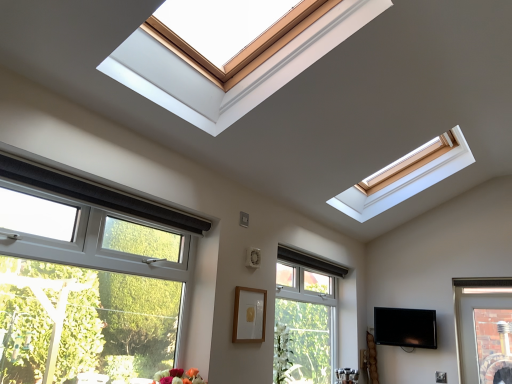
Question: Is black glossy tv at lower right to the left or to the right of clear glass window at center, the 2th window from the left, in the image?

Choices:
 (A) right
 (B) left

Answer: (A)

Question: From the image's perspective, is black glossy tv at lower right located above or below clear glass window at center, the 2th window from the left?

Choices:
 (A) below
 (B) above

Answer: (A)

Question: Which object is positioned closest to the white glossy vase at center?

Choices:
 (A) wooden picture frame at center
 (B) white plastic window at lower left, which is the 2th window in back-to-front order
 (C) clear glass window at center, placed as the second window when sorted from front to back
 (D) black glossy tv at lower right

Answer: (C)

Question: Estimate the real-world distances between objects in this image. Which object is farther from the clear glass window at center, the first window from the back?

Choices:
 (A) white glossy vase at center
 (B) white plastic window at lower left, the second window viewed from the right
 (C) black glossy tv at lower right
 (D) wooden picture frame at center

Answer: (B)